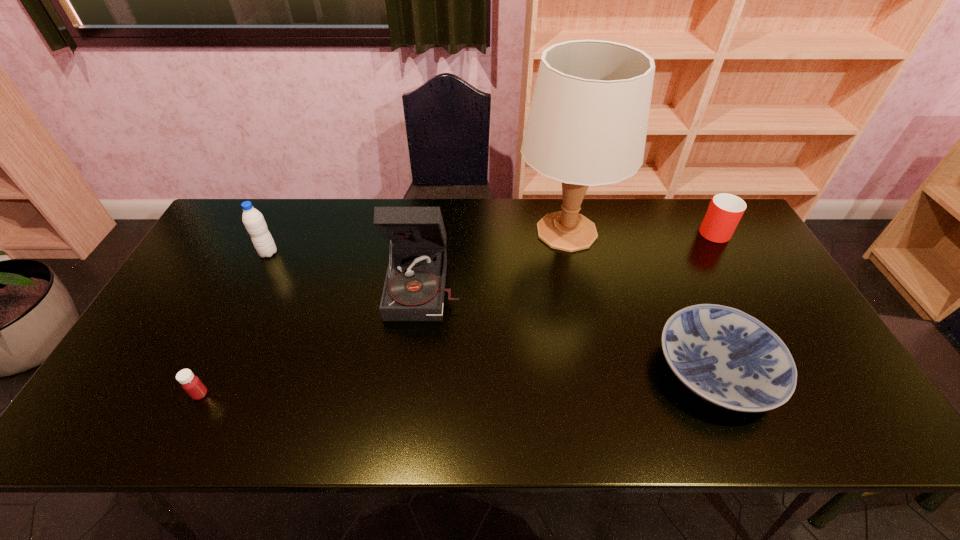
The image size is (960, 540). In the image, there is a desktop. What are the coordinates of `vacant space at the near edge` in the screenshot? It's located at (321, 411).

Find the location of a particular element. The height and width of the screenshot is (540, 960). blank space at the left edge is located at coordinates (216, 273).

The width and height of the screenshot is (960, 540). I want to click on free space at the right edge of the desktop, so click(x=772, y=274).

In order to click on vacant area that lies between the table lamp and the fifth shortest object in this screenshot , I will do `click(495, 258)`.

This screenshot has height=540, width=960. Identify the location of free area in between the medicine and the plate. (458, 382).

The height and width of the screenshot is (540, 960). What are the coordinates of `free space between the third shortest object and the table lamp` in the screenshot? It's located at (639, 231).

Locate an element on the screen. free spot between the third tallest object and the phonograph_record is located at coordinates (347, 268).

Locate an element on the screen. free spot between the medicine and the cup is located at coordinates (456, 312).

Locate an element on the screen. This screenshot has width=960, height=540. vacant space that's between the fourth shortest object and the third object from left to right is located at coordinates (347, 268).

Locate an element on the screen. This screenshot has width=960, height=540. empty space that is in between the water bottle and the fourth tallest object is located at coordinates (491, 241).